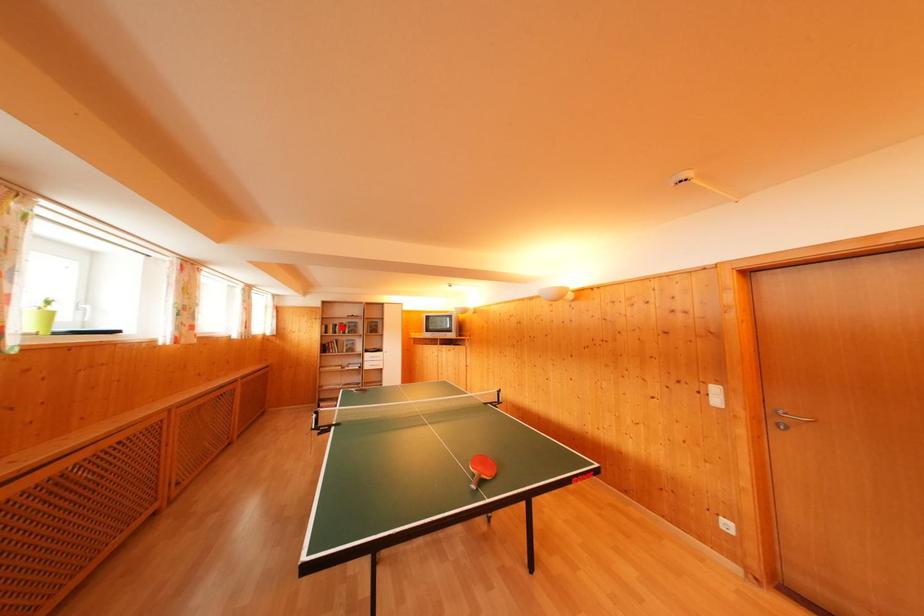
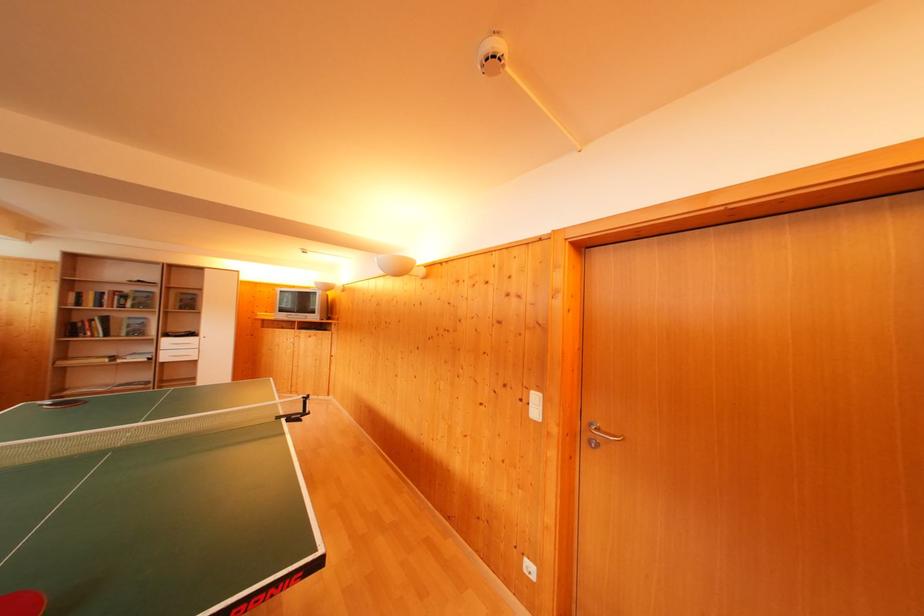
Locate, in the second image, the point that corresponds to the highlighted location in the first image.

(112, 294)